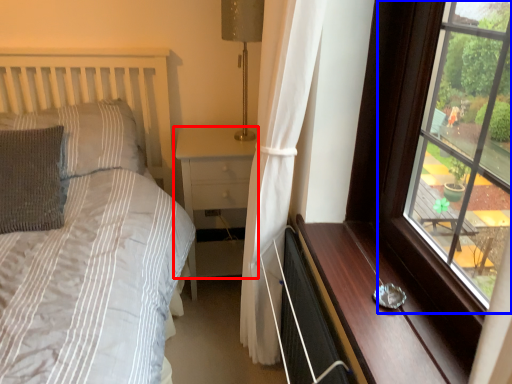
Question: Which object is further to the camera taking this photo, nightstand (highlighted by a red box) or window (highlighted by a blue box)?

Choices:
 (A) nightstand
 (B) window

Answer: (A)